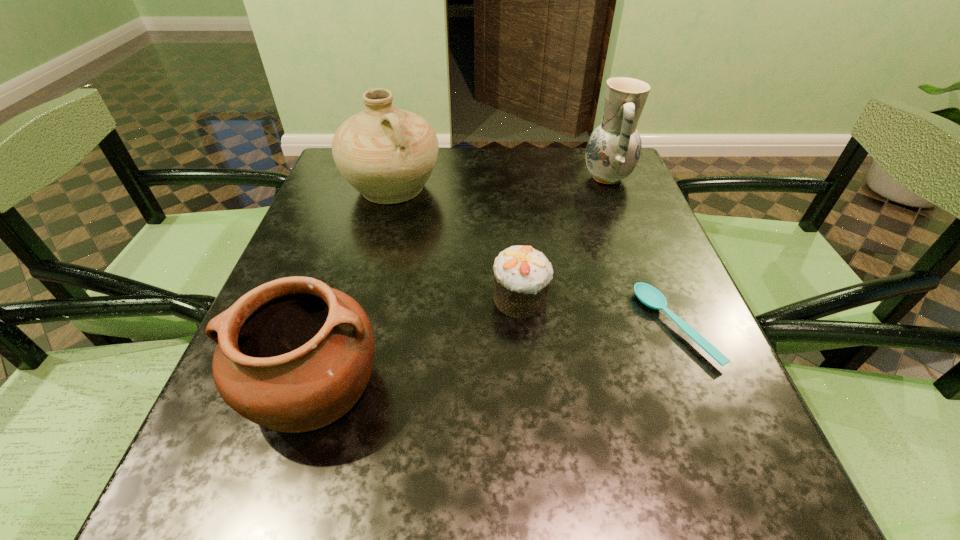
The image size is (960, 540). What are the coordinates of `the rightmost pottery` in the screenshot? It's located at (613, 150).

Locate an element on the screen. The width and height of the screenshot is (960, 540). the third tallest object is located at coordinates (293, 355).

The width and height of the screenshot is (960, 540). I want to click on the shortest pottery, so click(x=293, y=355).

Locate an element on the screen. the third object from right to left is located at coordinates (522, 275).

Find the location of a particular element. The width and height of the screenshot is (960, 540). cupcake is located at coordinates (522, 275).

I want to click on spoon, so click(x=648, y=295).

I want to click on free space located on either side of the rightmost pottery, so click(x=431, y=178).

Identify the location of free space located on either side of the rightmost pottery. This screenshot has height=540, width=960. (516, 178).

At what (x,y) coordinates should I click in order to perform the action: click on vacant space located 0.210m on either side of the rightmost pottery. Please return your answer as a coordinate pair (x, y). This screenshot has height=540, width=960. Looking at the image, I should click on (500, 178).

You are a GUI agent. You are given a task and a screenshot of the screen. Output one action in this format:
    pyautogui.click(x=<x>, y=<y>)
    Task: Click on the vacant position located 0.230m on the back of the third shortest object
    This screenshot has width=960, height=540.
    Given the screenshot: What is the action you would take?
    pyautogui.click(x=356, y=247)